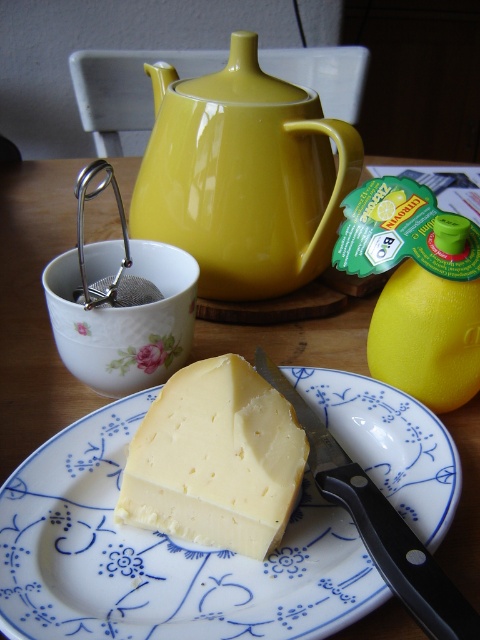
In the scene shown: Can you confirm if yellow cheese at center is taller than glossy ceramic teapot at upper center?

No, yellow cheese at center is not taller than glossy ceramic teapot at upper center.

Between yellow cheese at center and glossy ceramic teapot at upper center, which one has more height?

With more height is glossy ceramic teapot at upper center.

What do you see at coordinates (160, 556) in the screenshot? I see `yellow cheese at center` at bounding box center [160, 556].

Where is `yellow cheese at center`? The height and width of the screenshot is (640, 480). yellow cheese at center is located at coordinates (160, 556).

Can you confirm if glossy ceramic teapot at upper center is positioned below yellow smooth cheese at center?

No, glossy ceramic teapot at upper center is not below yellow smooth cheese at center.

Image resolution: width=480 pixels, height=640 pixels. What are the coordinates of `glossy ceramic teapot at upper center` in the screenshot? It's located at (243, 176).

Is point (243, 168) more distant than point (288, 504)?

Yes, point (243, 168) is farther from viewer.

Find the location of a particular element. This screenshot has width=480, height=640. glossy ceramic teapot at upper center is located at coordinates (243, 176).

Consider the image. Can you confirm if yellow cheese at center is taller than yellow smooth cheese at center?

Correct, yellow cheese at center is much taller as yellow smooth cheese at center.

Is yellow cheese at center wider than yellow smooth cheese at center?

Correct, the width of yellow cheese at center exceeds that of yellow smooth cheese at center.

Does point (368, 449) lie in front of point (156, 490)?

No, (368, 449) is behind (156, 490).

Locate an element on the screen. yellow cheese at center is located at coordinates (160, 556).